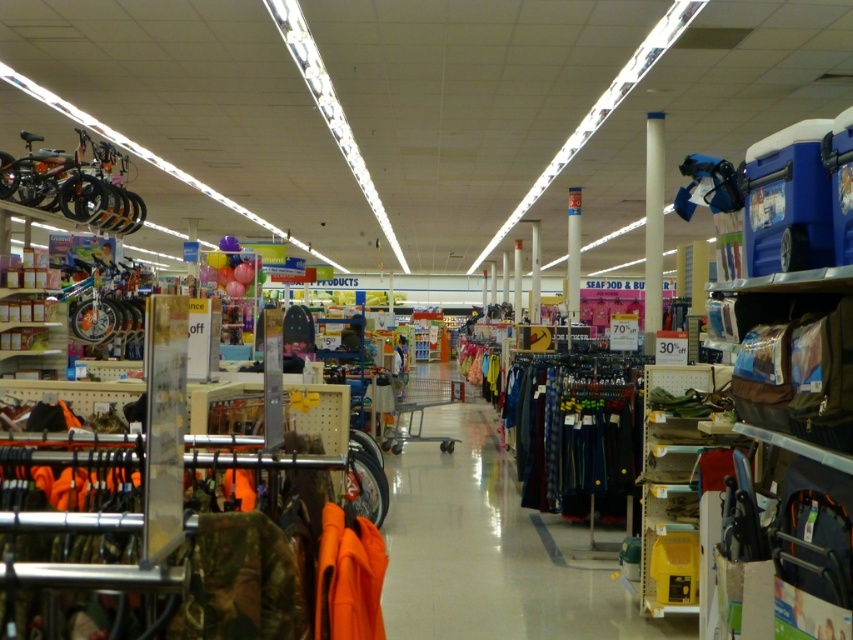
You are a store employee who needs to place a new item in the yellow plastic bin at lower right. However, there is a white matte pillar at center blocking your path. Can you walk around the pillar to reach the bin?

The yellow plastic bin at lower right is positioned on the left side of white matte pillar at center, so you can walk around the pillar from the right side to reach the bin.

You are standing in the retail store and want to determine which of the two points, point (662, 467) or point (662, 170), is closer to you. Based on the scene description, which point is nearer?

Point (662, 467) is closer to the viewer than point (662, 170).